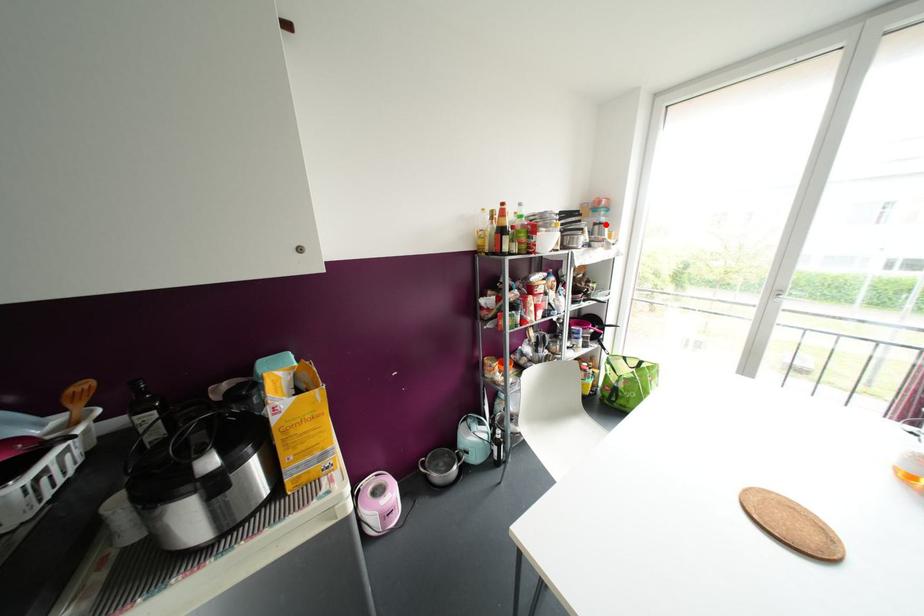
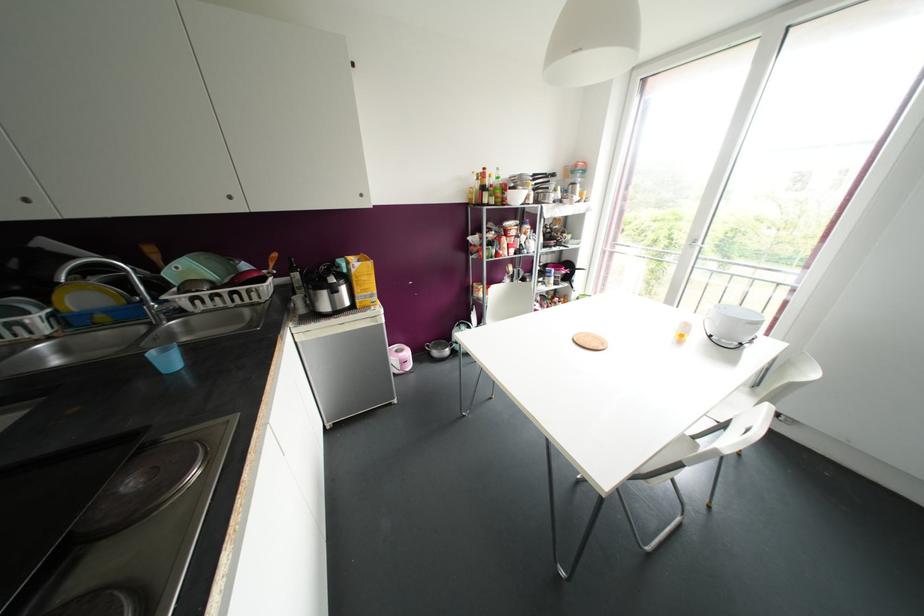
Question: I am providing you with two images of the same scene from different viewpoints. A red point is marked on the first image. At the location where the point appears in image 1, is it still visible in image 2?

Choices:
 (A) Yes
 (B) No

Answer: (A)